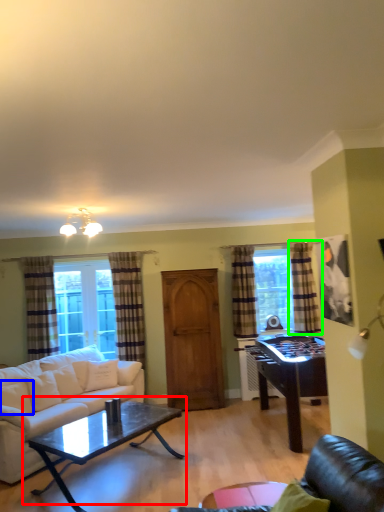
Question: Estimate the real-world distances between objects in this image. Which object is closer to coffee table (highlighted by a red box), pillow (highlighted by a blue box) or curtain (highlighted by a green box)?

Choices:
 (A) pillow
 (B) curtain

Answer: (A)